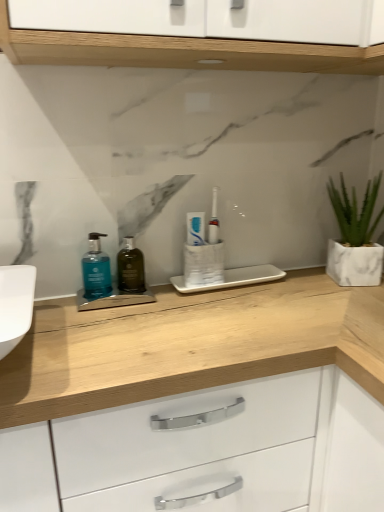
Question: From the image's perspective, is white matte tube at center below white marble planter at right?

Choices:
 (A) yes
 (B) no

Answer: (A)

Question: Are white matte tube at center and white marble planter at right making contact?

Choices:
 (A) yes
 (B) no

Answer: (B)

Question: Is white matte tube at center aimed at white marble planter at right?

Choices:
 (A) no
 (B) yes

Answer: (A)

Question: From a real-world perspective, is white matte tube at center on top of white marble planter at right?

Choices:
 (A) no
 (B) yes

Answer: (B)

Question: Does white matte tube at center have a lesser width compared to white marble planter at right?

Choices:
 (A) no
 (B) yes

Answer: (B)

Question: From the image's perspective, is white matte tube at center above or below blue matte liquid soap at left, which is the 2th mouthwash in right-to-left order?

Choices:
 (A) below
 (B) above

Answer: (B)

Question: Looking at their shapes, would you say white matte tube at center is wider or thinner than blue matte liquid soap at left, which is the 2th mouthwash in right-to-left order?

Choices:
 (A) thin
 (B) wide

Answer: (A)

Question: Considering the positions of white matte tube at center and blue matte liquid soap at left, which is the first mouthwash in left-to-right order, in the image, is white matte tube at center bigger or smaller than blue matte liquid soap at left, which is the first mouthwash in left-to-right order,?

Choices:
 (A) small
 (B) big

Answer: (A)

Question: Based on their positions, is white matte tube at center located to the left or right of blue matte liquid soap at left, which is the first mouthwash in left-to-right order?

Choices:
 (A) left
 (B) right

Answer: (B)

Question: In the image, is dark green glass bottle at center, positioned as the second mouthwash in left-to-right order, positioned in front of or behind white matte tube at center?

Choices:
 (A) front
 (B) behind

Answer: (A)

Question: Does point (142, 281) appear closer or farther from the camera than point (201, 230)?

Choices:
 (A) closer
 (B) farther

Answer: (B)

Question: Considering the positions of dark green glass bottle at center, the 1th mouthwash when ordered from right to left, and white matte tube at center in the image, is dark green glass bottle at center, the 1th mouthwash when ordered from right to left, bigger or smaller than white matte tube at center?

Choices:
 (A) big
 (B) small

Answer: (A)

Question: From the image's perspective, is dark green glass bottle at center, the 1th mouthwash when ordered from right to left, located above or below white matte tube at center?

Choices:
 (A) below
 (B) above

Answer: (A)

Question: Relative to blue matte liquid soap at left, which is the 2th mouthwash in right-to-left order, is dark green glass bottle at center, the 1th mouthwash when ordered from right to left, in front or behind?

Choices:
 (A) behind
 (B) front

Answer: (A)

Question: From a real-world perspective, is dark green glass bottle at center, the 1th mouthwash when ordered from right to left, physically located above or below blue matte liquid soap at left, which is the 2th mouthwash in right-to-left order?

Choices:
 (A) below
 (B) above

Answer: (A)